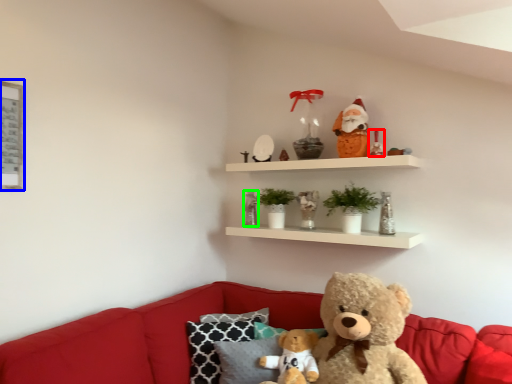
Question: Estimate the real-world distances between objects in this image. Which object is closer to toy (highlighted by a red box), picture frame (highlighted by a blue box) or toy (highlighted by a green box)?

Choices:
 (A) picture frame
 (B) toy

Answer: (B)